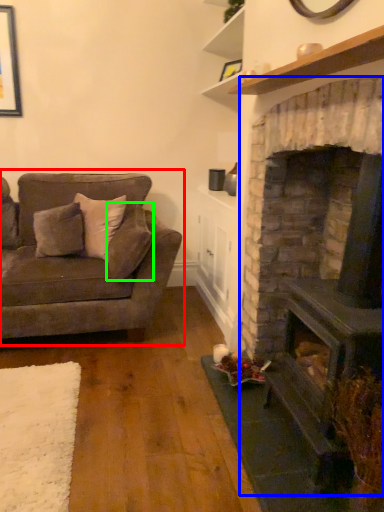
Question: Which object is the closest to the studio couch (highlighted by a red box)? Choose among these: fireplace (highlighted by a blue box) or pillow (highlighted by a green box).

Choices:
 (A) fireplace
 (B) pillow

Answer: (B)